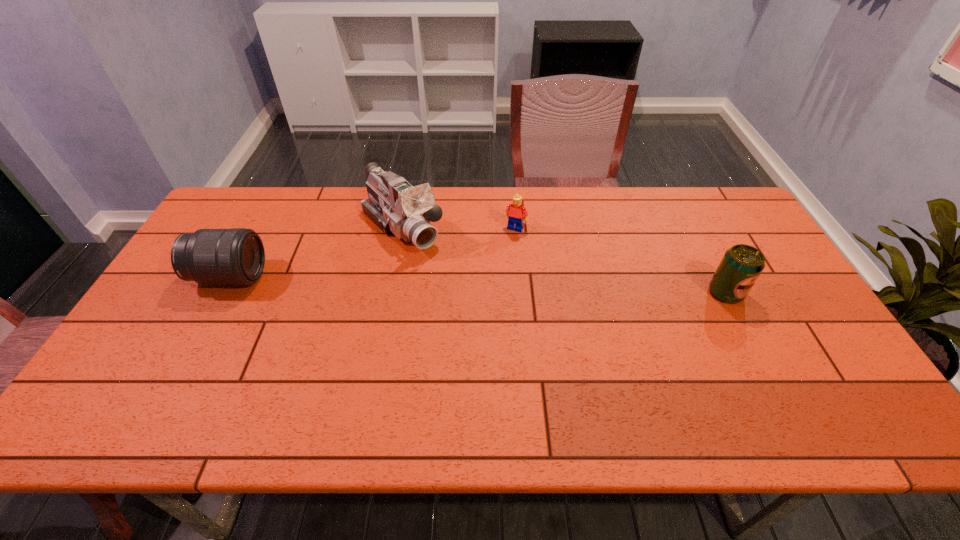
Where is `vacant area between the beer can and the camcorder`? vacant area between the beer can and the camcorder is located at coordinates (564, 260).

Choose which object is the third nearest neighbor to the leftmost object. Please provide its 2D coordinates. Your answer should be formatted as a tuple, i.e. [(x, y)], where the tuple contains the x and y coordinates of a point satisfying the conditions above.

[(741, 265)]

Select which object appears as the second closest to the camcorder. Please provide its 2D coordinates. Your answer should be formatted as a tuple, i.e. [(x, y)], where the tuple contains the x and y coordinates of a point satisfying the conditions above.

[(236, 256)]

Identify the location of free space that satisfies the following two spatial constraints: 1. on the front side of the Lego; 2. on the left side of the third object from right to left. The width and height of the screenshot is (960, 540). (402, 228).